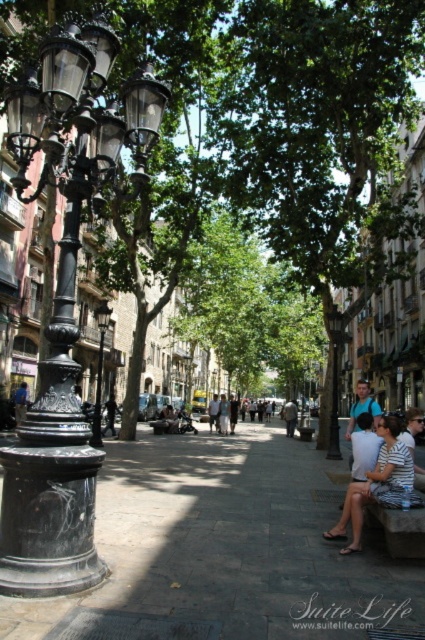
You are standing on the cobblestone pavement of this historic street and see two points marked on the ground. The first point is at coordinates point (x=334, y=362) and the second is at point (x=98, y=433). Which point is closer to your current position?

Point (x=334, y=362) is further to the camera than point (x=98, y=433), so the point closer to your current position is point (x=98, y=433).

You are a city planner assessing the street layout. You need to install a new bench that requires a 1.5 meter wide space. Given the black metal lamp post at center and the black metal lamp post at left, which lamp post has enough space around it to accommodate the bench?

The black metal lamp post at left has a greater width than the black metal lamp post at center, so it likely has more space around it. Therefore, the bench can be placed near the black metal lamp post at left.